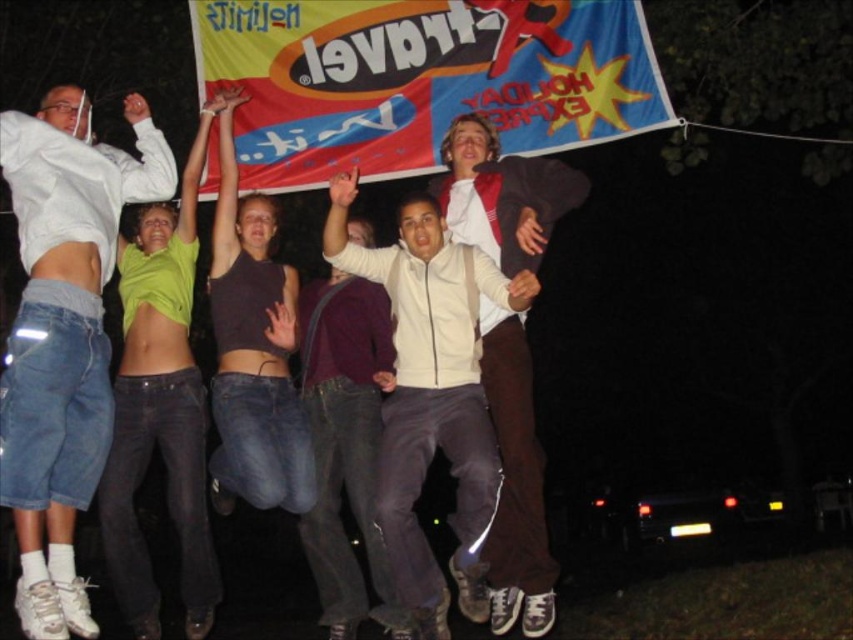
Is red fabric banner at upper center wider than brown leather jacket at center?

Yes, red fabric banner at upper center is wider than brown leather jacket at center.

Between point (495, 52) and point (492, 358), which one is positioned in front?

Point (492, 358) is in front.

Locate an element on the screen. This screenshot has width=853, height=640. red fabric banner at upper center is located at coordinates (421, 80).

Between white cotton hoodie at upper left and brown leather jacket at center, which one has more height?

Standing taller between the two is white cotton hoodie at upper left.

Is point (85, 193) farther from viewer compared to point (514, 573)?

Yes, it is.

Where is `white cotton hoodie at upper left`? Image resolution: width=853 pixels, height=640 pixels. white cotton hoodie at upper left is located at coordinates (62, 336).

Can you confirm if red fabric banner at upper center is positioned to the left of white cotton hoodie at upper left?

In fact, red fabric banner at upper center is to the right of white cotton hoodie at upper left.

Who is positioned more to the right, red fabric banner at upper center or white cotton hoodie at upper left?

red fabric banner at upper center is more to the right.

You are a GUI agent. You are given a task and a screenshot of the screen. Output one action in this format:
    pyautogui.click(x=<x>, y=<y>)
    Task: Click on the red fabric banner at upper center
    
    Given the screenshot: What is the action you would take?
    pyautogui.click(x=421, y=80)